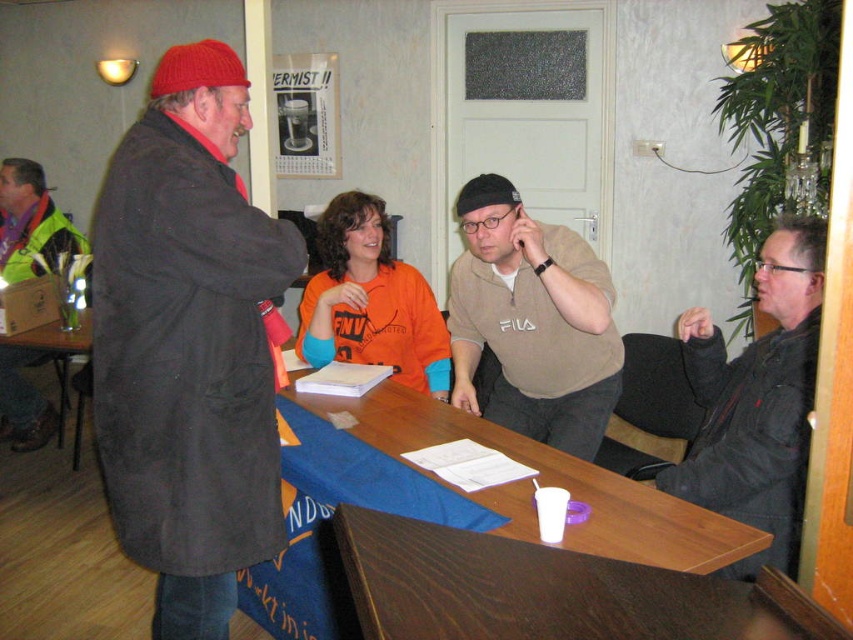
Question: Is green reflective jacket at left in front of wooden table at lower left?

Choices:
 (A) yes
 (B) no

Answer: (B)

Question: Which point is closer to the camera taking this photo?

Choices:
 (A) (149, 477)
 (B) (305, 435)

Answer: (A)

Question: Which object appears farthest from the camera in this image?

Choices:
 (A) orange cotton shirt at center
 (B) green reflective jacket at left

Answer: (B)

Question: Among these points, which one is farthest from the camera?

Choices:
 (A) (74, 340)
 (B) (76, 241)

Answer: (B)

Question: Does matte black coat at left appear on the right side of beige cotton shirt at center?

Choices:
 (A) yes
 (B) no

Answer: (B)

Question: Does orange cotton shirt at center come in front of green reflective jacket at left?

Choices:
 (A) no
 (B) yes

Answer: (B)